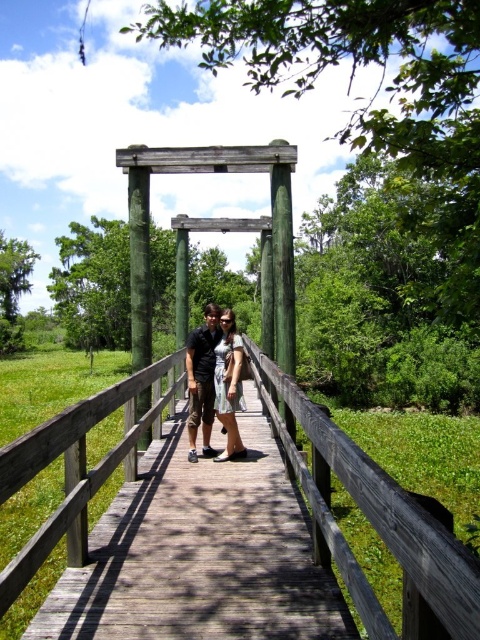
Does green wood post at center have a smaller size compared to matte green dress at center?

No, green wood post at center is not smaller than matte green dress at center.

Between point (136, 209) and point (229, 449), which one is positioned behind?

The point (136, 209) is more distant.

Is point (140, 332) closer to viewer compared to point (232, 337)?

That is False.

Where is `green wood post at center`? Image resolution: width=480 pixels, height=640 pixels. green wood post at center is located at coordinates (140, 266).

Is the position of wooden bridge at center less distant than that of green wood post at center?

That is True.

Does wooden bridge at center appear on the left side of green wood post at center?

In fact, wooden bridge at center is to the right of green wood post at center.

Is point (199, 595) positioned in front of point (133, 228)?

Yes, it is in front of point (133, 228).

Identify the location of wooden bridge at center. The image size is (480, 640). (194, 579).

Does green wood post at center appear on the left side of dark gray shirt at center?

Yes, green wood post at center is to the left of dark gray shirt at center.

Does green wood post at center have a lesser width compared to dark gray shirt at center?

No, green wood post at center is not thinner than dark gray shirt at center.

This screenshot has height=640, width=480. What do you see at coordinates (140, 266) in the screenshot?
I see `green wood post at center` at bounding box center [140, 266].

Identify the location of green wood post at center. The width and height of the screenshot is (480, 640). (140, 266).